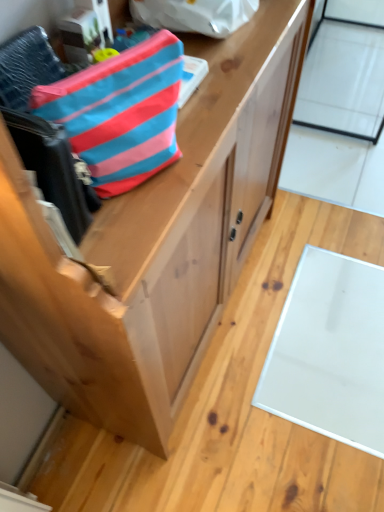
Question: Is blue striped fabric pouch at upper left, the 2th pouch in the top-to-bottom sequence, directly adjacent to blue striped fabric pouch at upper center, the 1th pouch viewed from the top?

Choices:
 (A) no
 (B) yes

Answer: (A)

Question: Does blue striped fabric pouch at upper left, marked as the 1th pouch in a front-to-back arrangement, turn towards blue striped fabric pouch at upper center, the 2th pouch positioned from the bottom?

Choices:
 (A) no
 (B) yes

Answer: (A)

Question: From a real-world perspective, is blue striped fabric pouch at upper left, positioned as the second pouch in back-to-front order, below blue striped fabric pouch at upper center, the 2th pouch when ordered from front to back?

Choices:
 (A) yes
 (B) no

Answer: (B)

Question: From a real-world perspective, is blue striped fabric pouch at upper left, which is the first pouch from bottom to top, located higher than blue striped fabric pouch at upper center, the 2th pouch when ordered from front to back?

Choices:
 (A) yes
 (B) no

Answer: (A)

Question: Can you confirm if blue striped fabric pouch at upper left, the 2th pouch in the top-to-bottom sequence, is positioned to the left of blue striped fabric pouch at upper center, the 1th pouch viewed from the top?

Choices:
 (A) yes
 (B) no

Answer: (A)

Question: Is natural wood cabinet at center taller or shorter than blue striped fabric pouch at upper center, the 2th pouch when ordered from front to back?

Choices:
 (A) short
 (B) tall

Answer: (B)

Question: Is natural wood cabinet at center bigger or smaller than blue striped fabric pouch at upper center, the 2th pouch positioned from the bottom?

Choices:
 (A) small
 (B) big

Answer: (B)

Question: In the image, is natural wood cabinet at center on the left side or the right side of blue striped fabric pouch at upper center, the 2th pouch when ordered from front to back?

Choices:
 (A) left
 (B) right

Answer: (B)

Question: From a real-world perspective, is natural wood cabinet at center physically located above or below blue striped fabric pouch at upper center, the 2th pouch when ordered from front to back?

Choices:
 (A) below
 (B) above

Answer: (A)

Question: From the image's perspective, is transparent glass door at upper right above or below blue striped fabric pouch at upper left, positioned as the second pouch in back-to-front order?

Choices:
 (A) above
 (B) below

Answer: (A)

Question: From a real-world perspective, is transparent glass door at upper right positioned above or below blue striped fabric pouch at upper left, positioned as the second pouch in back-to-front order?

Choices:
 (A) above
 (B) below

Answer: (B)

Question: Relative to blue striped fabric pouch at upper left, the 2th pouch in the top-to-bottom sequence, is transparent glass door at upper right in front or behind?

Choices:
 (A) front
 (B) behind

Answer: (B)

Question: Considering the positions of transparent glass door at upper right and blue striped fabric pouch at upper left, the 2th pouch in the top-to-bottom sequence, in the image, is transparent glass door at upper right taller or shorter than blue striped fabric pouch at upper left, the 2th pouch in the top-to-bottom sequence,?

Choices:
 (A) short
 (B) tall

Answer: (B)

Question: From a real-world perspective, relative to transparent glass door at upper right, is blue striped fabric pouch at upper left, the 2th pouch in the top-to-bottom sequence, vertically above or below?

Choices:
 (A) above
 (B) below

Answer: (A)

Question: Is blue striped fabric pouch at upper left, marked as the 1th pouch in a front-to-back arrangement, inside the boundaries of transparent glass door at upper right, or outside?

Choices:
 (A) outside
 (B) inside

Answer: (A)